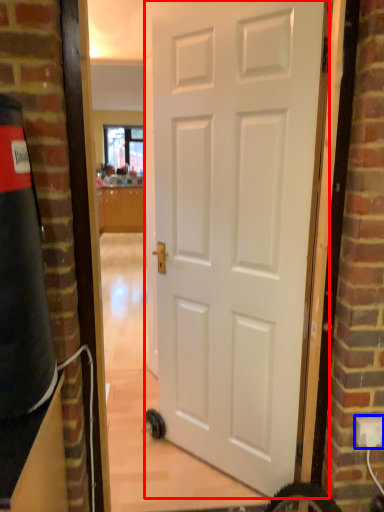
Question: Which object appears closest to the camera in this image, door (highlighted by a red box) or electric outlet (highlighted by a blue box)?

Choices:
 (A) door
 (B) electric outlet

Answer: (A)